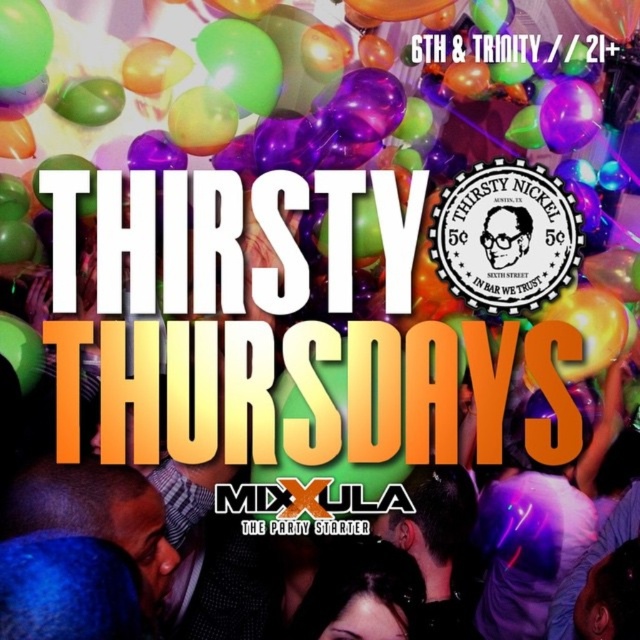
Question: Which object is farther from the camera taking this photo?

Choices:
 (A) matte black glasses at center
 (B) blue fabric at lower left
 (C) black hair at center

Answer: (A)

Question: Which point is closer to the camera?

Choices:
 (A) (332, 636)
 (B) (134, 541)

Answer: (B)

Question: Does black hair at center have a lesser width compared to matte black glasses at center?

Choices:
 (A) no
 (B) yes

Answer: (A)

Question: Can you confirm if blue fabric at lower left is thinner than matte black glasses at center?

Choices:
 (A) no
 (B) yes

Answer: (A)

Question: Can you confirm if blue fabric at lower left is positioned to the right of black hair at center?

Choices:
 (A) yes
 (B) no

Answer: (B)

Question: Which of the following is the farthest from the observer?

Choices:
 (A) matte black glasses at center
 (B) blue fabric at lower left
 (C) black hair at center

Answer: (A)